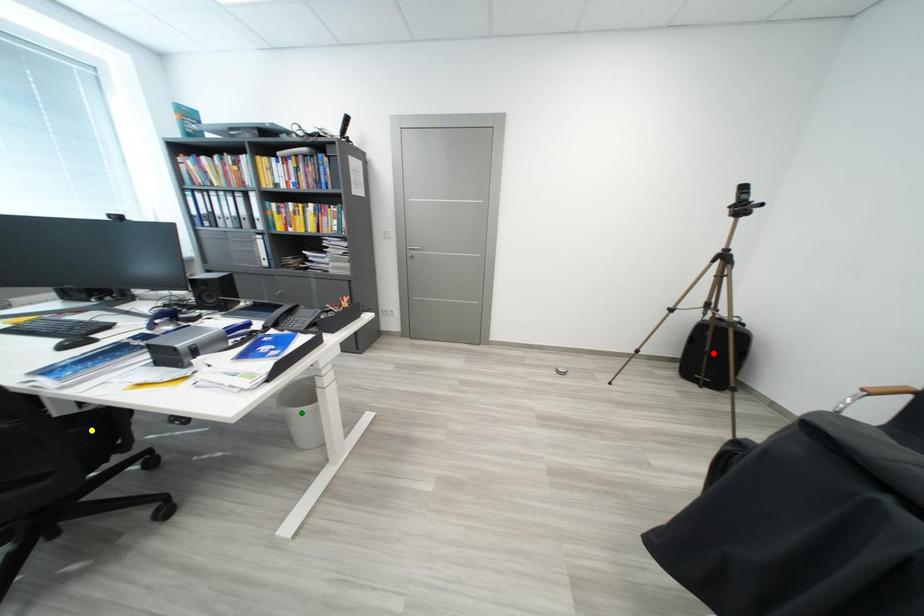
Order these from farthest to nearest:
yellow point | green point | red point

red point
green point
yellow point